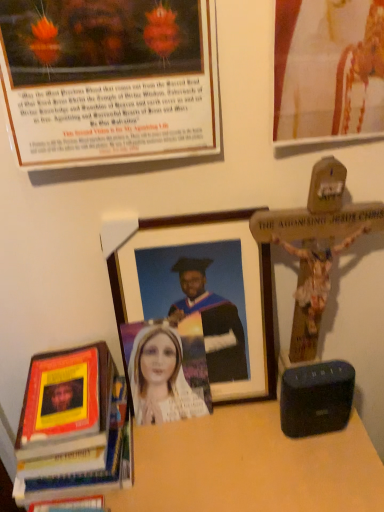
Question: Does matte wooden picture frame at upper left, the 2th picture frame in the top-to-bottom sequence, appear on the left side of hardcover book at lower left?

Choices:
 (A) no
 (B) yes

Answer: (A)

Question: From a real-world perspective, is matte wooden picture frame at upper left, the 2th picture frame in the top-to-bottom sequence, on hardcover book at lower left?

Choices:
 (A) no
 (B) yes

Answer: (B)

Question: Is matte wooden picture frame at upper left, the 2th picture frame in the top-to-bottom sequence, at the right side of hardcover book at lower left?

Choices:
 (A) no
 (B) yes

Answer: (B)

Question: Is matte wooden picture frame at upper left, the 2th picture frame in the top-to-bottom sequence, shorter than hardcover book at lower left?

Choices:
 (A) yes
 (B) no

Answer: (B)

Question: Is matte wooden picture frame at upper left, which is the 2th picture frame in bottom-to-top order, not close to hardcover book at lower left?

Choices:
 (A) no
 (B) yes

Answer: (A)

Question: Does matte wooden picture frame at upper left, the 2th picture frame in the top-to-bottom sequence, come behind hardcover book at lower left?

Choices:
 (A) yes
 (B) no

Answer: (B)

Question: Is matte gold picture frame at upper right, which is counted as the first picture frame, starting from the top, located outside wooden table at lower center?

Choices:
 (A) no
 (B) yes

Answer: (B)

Question: From the image's perspective, is matte gold picture frame at upper right, which is counted as the first picture frame, starting from the top, above wooden table at lower center?

Choices:
 (A) yes
 (B) no

Answer: (A)

Question: Is matte gold picture frame at upper right, which is counted as the first picture frame, starting from the top, closer to camera compared to wooden table at lower center?

Choices:
 (A) yes
 (B) no

Answer: (A)

Question: Can you confirm if matte gold picture frame at upper right, the 3th picture frame positioned from the bottom, is positioned to the right of wooden table at lower center?

Choices:
 (A) yes
 (B) no

Answer: (A)

Question: Is matte gold picture frame at upper right, which is counted as the first picture frame, starting from the top, smaller than wooden table at lower center?

Choices:
 (A) no
 (B) yes

Answer: (B)

Question: Does matte gold picture frame at upper right, the 3th picture frame positioned from the bottom, have a greater height compared to wooden table at lower center?

Choices:
 (A) yes
 (B) no

Answer: (B)

Question: Is wooden picture frame at center, acting as the 1th picture frame starting from the bottom, inside matte gold picture frame at upper right, the 3th picture frame positioned from the bottom?

Choices:
 (A) yes
 (B) no

Answer: (B)